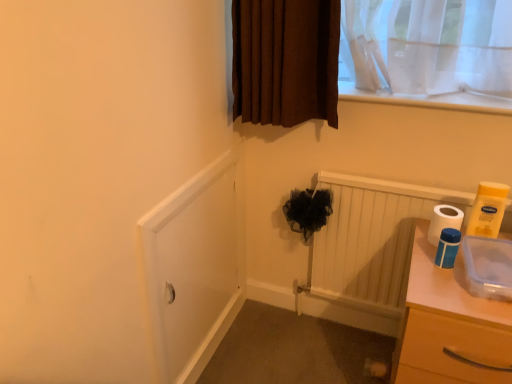
Identify the location of vacant space to the left of blue plastic toilet paper at right, which is the third toilet paper from right to left. (421, 269).